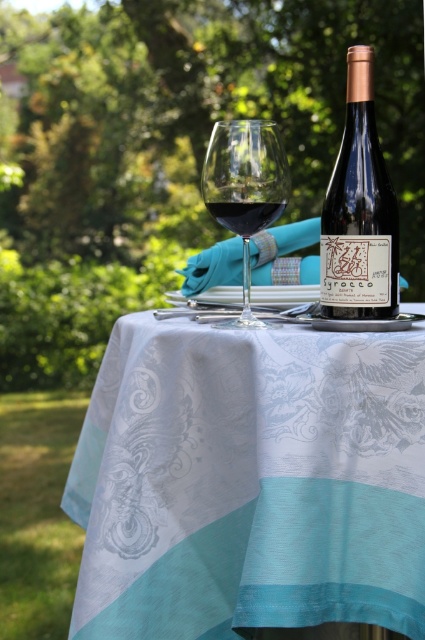
Question: Which of the following is the closest to the observer?

Choices:
 (A) (251, 272)
 (B) (384, 198)
 (C) (99, 465)

Answer: (B)

Question: Is matte black bottle at center above silky teal tablecloth at center?

Choices:
 (A) no
 (B) yes

Answer: (B)

Question: Among these objects, which one is nearest to the camera?

Choices:
 (A) silky blue tablecloth at center
 (B) transparent glass at center
 (C) dark red glass at center

Answer: (A)

Question: Can you confirm if silky blue tablecloth at center is bigger than dark red glass at center?

Choices:
 (A) yes
 (B) no

Answer: (A)

Question: Considering the real-world distances, which object is closest to the transparent glass at center?

Choices:
 (A) silky teal tablecloth at center
 (B) dark red glass at center

Answer: (B)

Question: Does silky blue tablecloth at center lie behind matte black bottle at center?

Choices:
 (A) no
 (B) yes

Answer: (A)